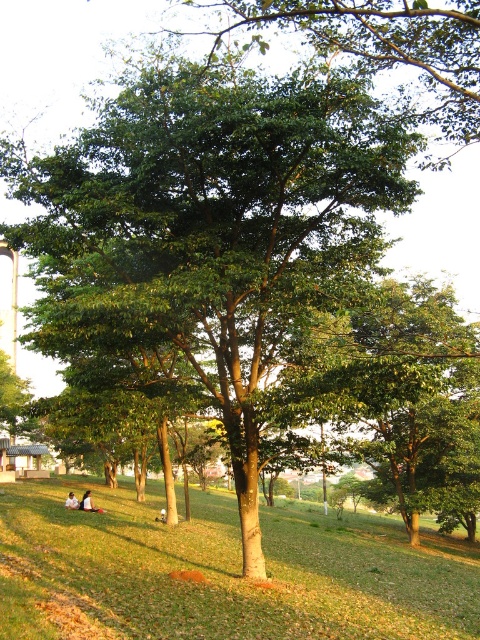
Question: Which of these objects is positioned closest to the white cotton shirt at lower left?

Choices:
 (A) green leafy tree at center
 (B) white cotton shirt at center
 (C) green grassy field at center

Answer: (B)

Question: Is green leafy tree at center bigger than white cotton shirt at lower left?

Choices:
 (A) no
 (B) yes

Answer: (B)

Question: Does green leafy tree at center appear over green grassy field at center?

Choices:
 (A) yes
 (B) no

Answer: (A)

Question: Which object is the farthest from the green leafy tree at center?

Choices:
 (A) white cotton shirt at center
 (B) white cotton shirt at lower left

Answer: (B)

Question: Is green leafy tree at center above green grassy field at center?

Choices:
 (A) yes
 (B) no

Answer: (A)

Question: Which of these objects is positioned farthest from the white cotton shirt at center?

Choices:
 (A) green grassy field at center
 (B) green leafy tree at center

Answer: (B)